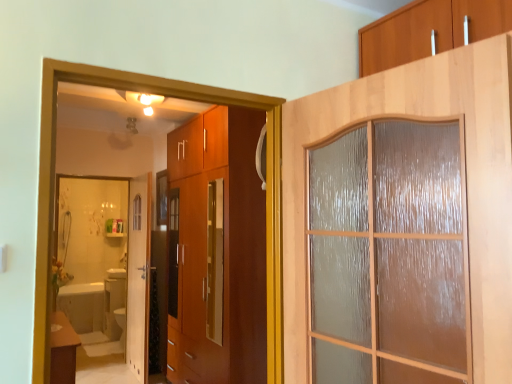
Question: Is white glossy mirror at lower left wider or thinner than white glossy bathtub at lower left?

Choices:
 (A) wide
 (B) thin

Answer: (B)

Question: In the image, is white glossy mirror at lower left positioned in front of or behind white glossy bathtub at lower left?

Choices:
 (A) behind
 (B) front

Answer: (B)

Question: Estimate the real-world distances between objects in this image. Which object is closer to the white glossy mirror at lower left?

Choices:
 (A) wooden frosted glass door at upper right, the 2th door when ordered from back to front
 (B) matte brown table at lower left
 (C) white glossy bathtub at lower left
 (D) white glossy door at center, the 1th door positioned from the back

Answer: (C)

Question: Estimate the real-world distances between objects in this image. Which object is closer to the white glossy door at center, acting as the second door starting from the front?

Choices:
 (A) wooden frosted glass door at upper right, the 2th door when ordered from left to right
 (B) white glossy mirror at lower left
 (C) white glossy bathtub at lower left
 (D) matte brown table at lower left

Answer: (B)